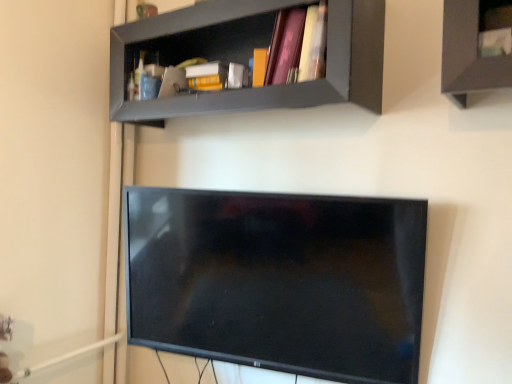
Question: Visually, is pink matte book at upper center positioned to the left or to the right of matte gray shelf at upper center?

Choices:
 (A) left
 (B) right

Answer: (B)

Question: Is pink matte book at upper center bigger or smaller than matte gray shelf at upper center?

Choices:
 (A) small
 (B) big

Answer: (A)

Question: Is point (316, 8) closer or farther from the camera than point (178, 92)?

Choices:
 (A) closer
 (B) farther

Answer: (A)

Question: Considering the positions of matte gray shelf at upper center and pink matte book at upper center in the image, is matte gray shelf at upper center taller or shorter than pink matte book at upper center?

Choices:
 (A) tall
 (B) short

Answer: (A)

Question: In the image, is matte gray shelf at upper center on the left side or the right side of pink matte book at upper center?

Choices:
 (A) left
 (B) right

Answer: (A)

Question: From the image's perspective, is matte gray shelf at upper center located above or below pink matte book at upper center?

Choices:
 (A) below
 (B) above

Answer: (B)

Question: In terms of size, does matte gray shelf at upper center appear bigger or smaller than pink matte book at upper center?

Choices:
 (A) big
 (B) small

Answer: (A)